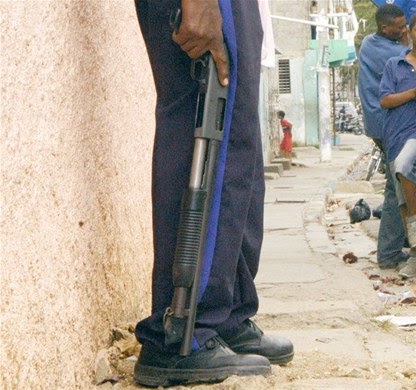
Locate an element on the screen. The image size is (416, 390). shoe is located at coordinates (226, 375).